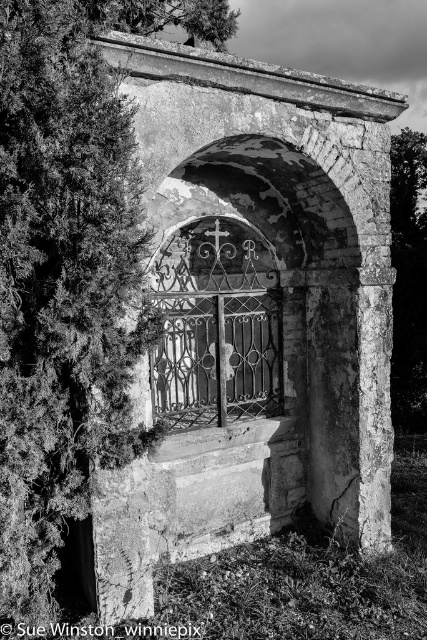
Is green leafy tree at left further to camera compared to wrought iron gate at center?

No, it is not.

Describe the element at coordinates (69, 272) in the screenshot. I see `green leafy tree at left` at that location.

Find the location of a particular element. green leafy tree at left is located at coordinates (69, 272).

How much distance is there between wrought iron gate at center and green leafy tree at right?

They are 15.03 feet apart.

Consider the image. Between wrought iron gate at center and green leafy tree at right, which one appears on the right side from the viewer's perspective?

green leafy tree at right is more to the right.

Is point (253, 328) positioned in front of point (392, 180)?

Yes.

You are a GUI agent. You are given a task and a screenshot of the screen. Output one action in this format:
    pyautogui.click(x=<x>, y=<y>)
    Task: Click on the wrought iron gate at center
    The height and width of the screenshot is (640, 427).
    Given the screenshot: What is the action you would take?
    pyautogui.click(x=218, y=358)

In order to click on green leafy tree at left in this screenshot , I will do `click(69, 272)`.

Between green leafy tree at left and green leafy tree at right, which one appears on the left side from the viewer's perspective?

Positioned to the left is green leafy tree at left.

Describe the element at coordinates (69, 272) in the screenshot. This screenshot has width=427, height=640. I see `green leafy tree at left` at that location.

The height and width of the screenshot is (640, 427). What are the coordinates of `green leafy tree at left` in the screenshot? It's located at (69, 272).